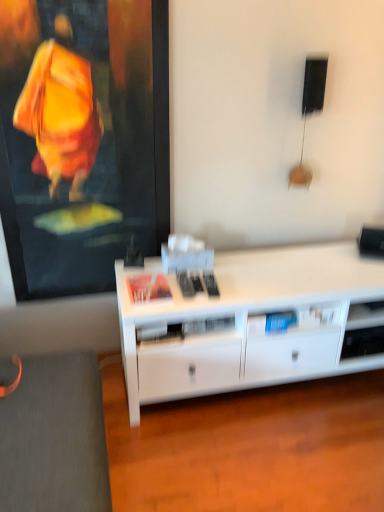
Where is `vacant area on top of textured fabric cushion at lower left (from a real-world perspective)`? This screenshot has width=384, height=512. vacant area on top of textured fabric cushion at lower left (from a real-world perspective) is located at coordinates pyautogui.click(x=39, y=421).